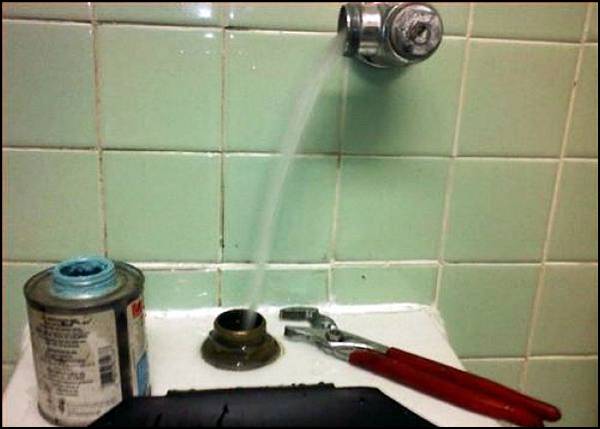
Image resolution: width=600 pixels, height=429 pixels. Find the location of `faucet`. faucet is located at coordinates (366, 29).